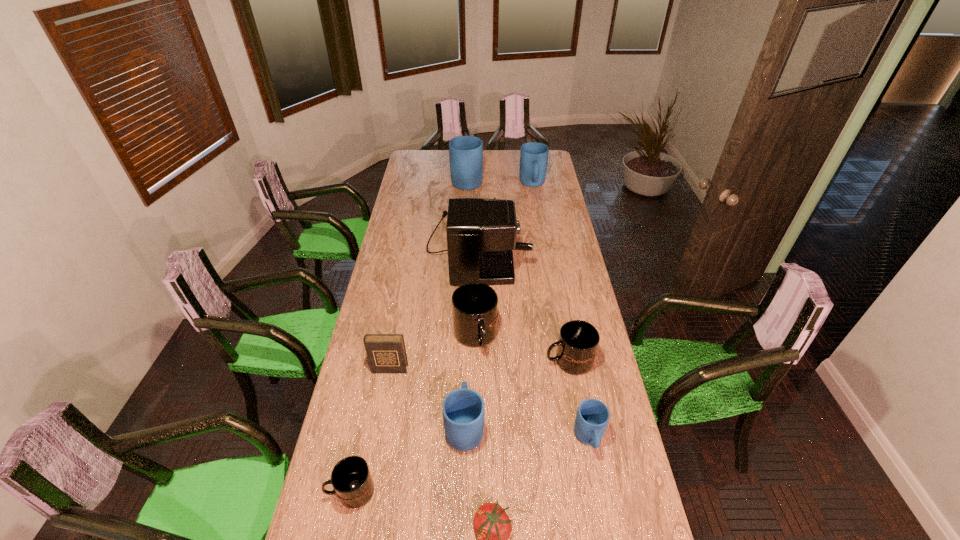
Locate an element on the screen. The image size is (960, 540). free space located on the side of the second smallest blue mug with the handle is located at coordinates (467, 356).

Find the location of `vacant space located 0.370m on the side of the second smallest blue mug with the handle`. vacant space located 0.370m on the side of the second smallest blue mug with the handle is located at coordinates (468, 322).

Locate an element on the screen. Image resolution: width=960 pixels, height=540 pixels. free space located with the handle on the side of the rightmost black mug is located at coordinates (474, 361).

Locate an element on the screen. The width and height of the screenshot is (960, 540). vacant space positioned 0.230m with the handle on the side of the rightmost black mug is located at coordinates (482, 361).

Where is `free location located 0.190m with the handle on the side of the rightmost black mug`? free location located 0.190m with the handle on the side of the rightmost black mug is located at coordinates (492, 361).

At what (x,y) coordinates should I click in order to perform the action: click on free space located 0.090m on the side of the smallest blue mug with the handle. Please return your answer as a coordinate pair (x, y). Image resolution: width=960 pixels, height=540 pixels. Looking at the image, I should click on (598, 490).

Image resolution: width=960 pixels, height=540 pixels. Identify the location of diary present at the left edge. (386, 353).

Where is `mug present at the left edge`? mug present at the left edge is located at coordinates (351, 479).

You are a GUI agent. You are given a task and a screenshot of the screen. Output one action in this format:
    pyautogui.click(x=<x>, y=<y>)
    Task: Click on the vacant space at the far edge of the desktop
    
    Given the screenshot: What is the action you would take?
    pyautogui.click(x=435, y=159)

The width and height of the screenshot is (960, 540). In the image, there is a desktop. What are the coordinates of `free space at the left edge` in the screenshot? It's located at (427, 173).